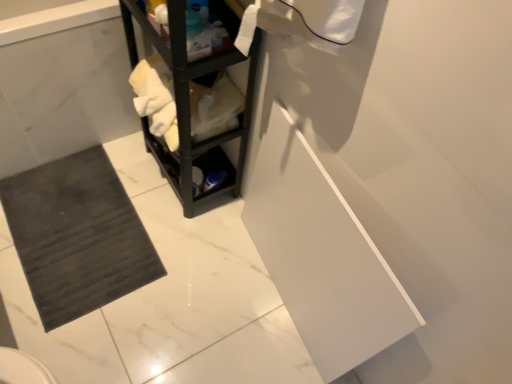
You are a GUI agent. You are given a task and a screenshot of the screen. Output one action in this format:
    pyautogui.click(x=<x>, y=<y>)
    Task: Click on the free location to the right of dark gray rubber bath mat at lower left
    
    Given the screenshot: What is the action you would take?
    pyautogui.click(x=192, y=276)